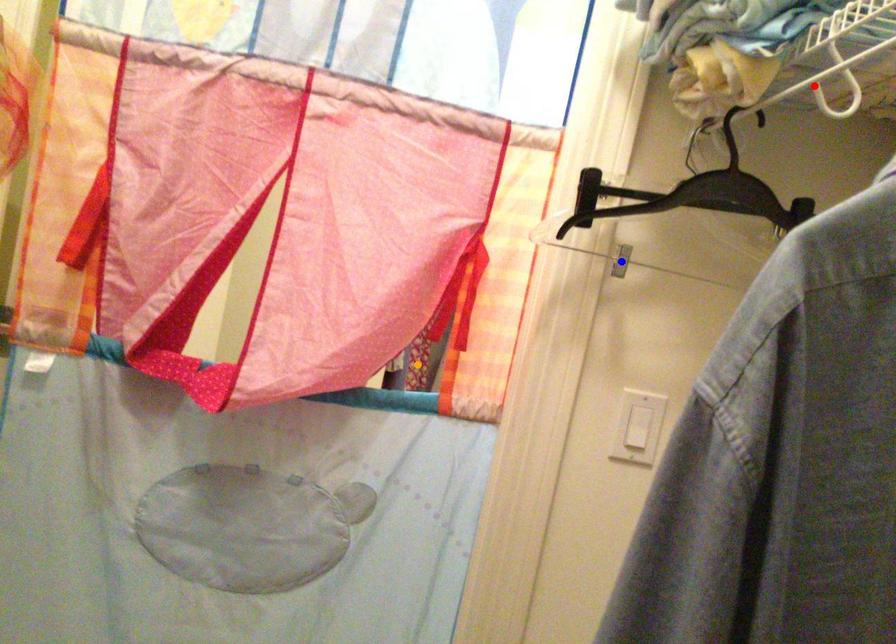
Order these from nearest to farthest:
orange point
red point
blue point

red point, blue point, orange point